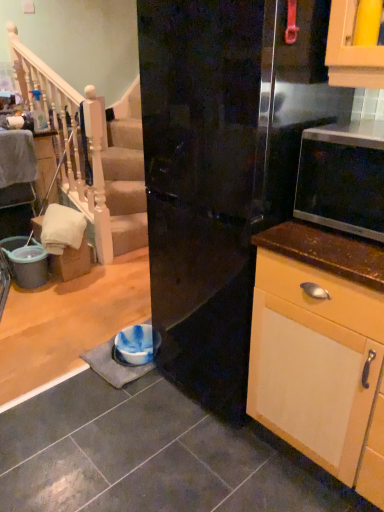
Question: Is matte black microwave at right taller or shorter than glossy black refrigerator at center?

Choices:
 (A) short
 (B) tall

Answer: (A)

Question: Is matte black microwave at right situated inside glossy black refrigerator at center or outside?

Choices:
 (A) outside
 (B) inside

Answer: (A)

Question: Which of these objects is positioned closest to the white wood railing at upper left?

Choices:
 (A) matte black microwave at right
 (B) glossy black refrigerator at center

Answer: (B)

Question: Which is nearer to the white wood railing at upper left?

Choices:
 (A) matte black microwave at right
 (B) glossy black refrigerator at center

Answer: (B)